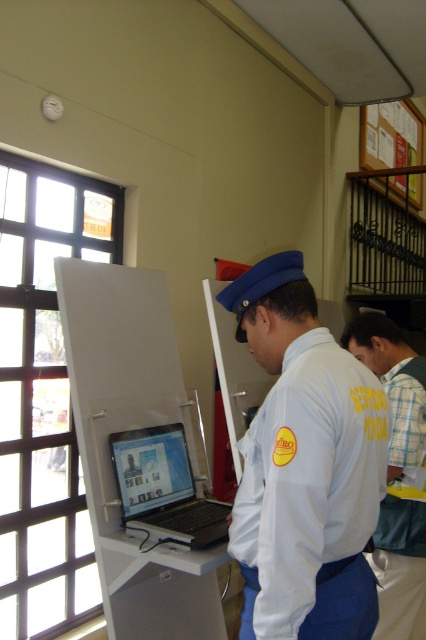
Question: Which of the following is the closest to the observer?

Choices:
 (A) (141, 509)
 (B) (397, 396)

Answer: (A)

Question: Is yellow fabric shirt at upper right wider than black plastic laptop at center?

Choices:
 (A) yes
 (B) no

Answer: (B)

Question: Where is light blue fabric uniform at center located in relation to black plastic laptop at center in the image?

Choices:
 (A) left
 (B) right

Answer: (B)

Question: Which point appears closest to the camera in this image?

Choices:
 (A) (374, 572)
 (B) (299, 490)

Answer: (B)

Question: Is white plastic laptop at left below black plastic laptop at center?

Choices:
 (A) no
 (B) yes

Answer: (A)

Question: Which object appears closest to the camera in this image?

Choices:
 (A) yellow fabric shirt at upper right
 (B) black plastic laptop at center
 (C) white plastic laptop at left
 (D) light blue fabric uniform at center

Answer: (D)